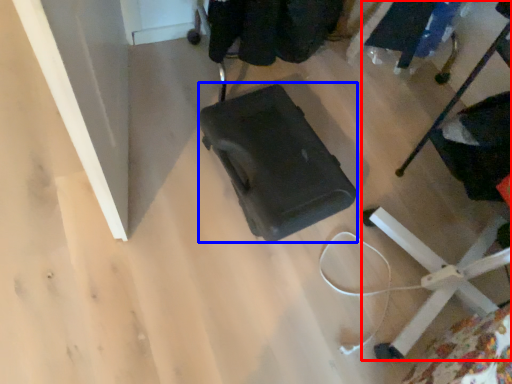
Question: Which point is closer to the camera, furniture (highlighted by a red box) or baby carriage (highlighted by a blue box)?

Choices:
 (A) furniture
 (B) baby carriage

Answer: (A)